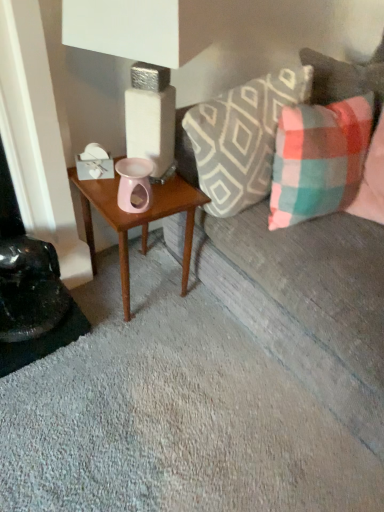
Question: In the image, is plaid fabric pillow at upper right, which is the 1th pillow in left-to-right order, on the left side or the right side of plaid fabric couch at upper right?

Choices:
 (A) left
 (B) right

Answer: (A)

Question: Is plaid fabric pillow at upper right, arranged as the 2th pillow when viewed from the right, in front of or behind plaid fabric couch at upper right in the image?

Choices:
 (A) behind
 (B) front

Answer: (A)

Question: Which is nearer to the plaid fabric couch at upper right?

Choices:
 (A) plaid fabric pillow at right, the 1th pillow viewed from the right
 (B) wooden table at center
 (C) plaid fabric pillow at upper right, which is the 1th pillow in left-to-right order

Answer: (A)

Question: Which object is the farthest from the plaid fabric pillow at upper right, arranged as the 2th pillow when viewed from the right?

Choices:
 (A) plaid fabric pillow at right, the 1th pillow viewed from the right
 (B) wooden table at center
 (C) plaid fabric couch at upper right

Answer: (C)